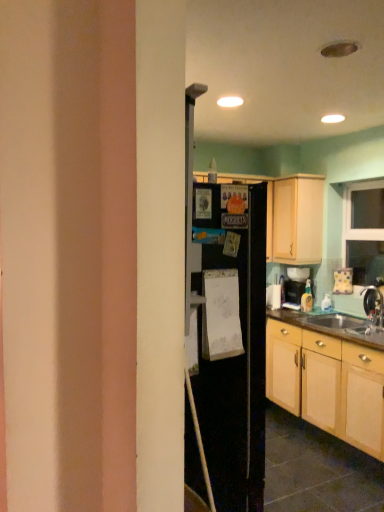
You are a GUI agent. You are given a task and a screenshot of the screen. Output one action in this format:
    pyautogui.click(x=<x>, y=<y>)
    Task: Click on the free space to the left of metallic silver faucet at lower right
    The height and width of the screenshot is (512, 384).
    Given the screenshot: What is the action you would take?
    point(352,327)